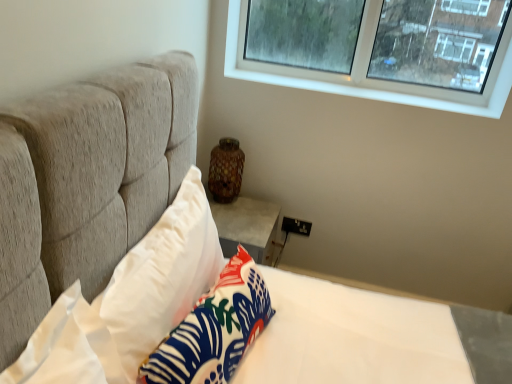
Locate an element on the screen. Image resolution: width=512 pixels, height=384 pixels. clear glass window at upper right is located at coordinates (364, 87).

Image resolution: width=512 pixels, height=384 pixels. Describe the element at coordinates (383, 90) in the screenshot. I see `white smooth stone at upper right` at that location.

The width and height of the screenshot is (512, 384). Identify the location of brown speckled ceramic vase at center. [x=226, y=170].

Find the location of a particular element. white fabric pillow at lower center, the 2th pillow when ordered from left to right is located at coordinates click(x=214, y=329).

In terms of size, does white fabric pillow at lower center, the first pillow from the right, appear bigger or smaller than white soft pillow at upper left, the 1th pillow when ordered from left to right?

In the image, white fabric pillow at lower center, the first pillow from the right, appears to be smaller than white soft pillow at upper left, the 1th pillow when ordered from left to right.

Is white fabric pillow at lower center, the first pillow from the right, situated inside white soft pillow at upper left, positioned as the 2th pillow in right-to-left order, or outside?

white fabric pillow at lower center, the first pillow from the right, is inside white soft pillow at upper left, positioned as the 2th pillow in right-to-left order.

From the image's perspective, is white fabric pillow at lower center, the 2th pillow when ordered from left to right, under white soft pillow at upper left, the 1th pillow when ordered from left to right?

Yes, from the image's perspective, white fabric pillow at lower center, the 2th pillow when ordered from left to right, is below white soft pillow at upper left, the 1th pillow when ordered from left to right.

Could you tell me if white fabric pillow at lower center, the 2th pillow when ordered from left to right, is turned towards white soft pillow at upper left, positioned as the 2th pillow in right-to-left order?

No, white fabric pillow at lower center, the 2th pillow when ordered from left to right, does not turn towards white soft pillow at upper left, positioned as the 2th pillow in right-to-left order.

Looking at their sizes, would you say white fabric pillow at lower center, the first pillow from the right, is wider or thinner than white smooth stone at upper right?

white fabric pillow at lower center, the first pillow from the right, is thinner than white smooth stone at upper right.

Between point (254, 326) and point (506, 96), which one is positioned in front?

The point (254, 326) is more forward.

Is white fabric pillow at lower center, the first pillow from the right, smaller than white smooth stone at upper right?

Incorrect, white fabric pillow at lower center, the first pillow from the right, is not smaller in size than white smooth stone at upper right.

From the image's perspective, is white fabric pillow at lower center, the 2th pillow when ordered from left to right, positioned above or below white smooth stone at upper right?

white fabric pillow at lower center, the 2th pillow when ordered from left to right, is below white smooth stone at upper right.

Considering the relative positions of brown speckled ceramic vase at center and white smooth stone at upper right in the image provided, is brown speckled ceramic vase at center to the left of white smooth stone at upper right from the viewer's perspective?

Yes, brown speckled ceramic vase at center is to the left of white smooth stone at upper right.

Does brown speckled ceramic vase at center have a larger size compared to white smooth stone at upper right?

Yes.

Which of these two, brown speckled ceramic vase at center or white smooth stone at upper right, is thinner?

With smaller width is brown speckled ceramic vase at center.

Who is shorter, brown speckled ceramic vase at center or white smooth stone at upper right?

With less height is white smooth stone at upper right.

Is clear glass window at upper right positioned with its back to brown speckled ceramic vase at center?

That's not correct — clear glass window at upper right is not looking away from brown speckled ceramic vase at center.

Between clear glass window at upper right and brown speckled ceramic vase at center, which one appears on the right side from the viewer's perspective?

clear glass window at upper right.

Is clear glass window at upper right surrounding brown speckled ceramic vase at center?

No, brown speckled ceramic vase at center is located outside of clear glass window at upper right.

Is clear glass window at upper right taller than white soft pillow at upper left, the 1th pillow when ordered from left to right?

In fact, clear glass window at upper right may be shorter than white soft pillow at upper left, the 1th pillow when ordered from left to right.

From the image's perspective, is clear glass window at upper right located above or below white soft pillow at upper left, the 1th pillow when ordered from left to right?

Clearly, from the image's perspective, clear glass window at upper right is above white soft pillow at upper left, the 1th pillow when ordered from left to right.

Can you tell me how much clear glass window at upper right and white soft pillow at upper left, positioned as the 2th pillow in right-to-left order, differ in facing direction?

88.8 degrees separate the facing orientations of clear glass window at upper right and white soft pillow at upper left, positioned as the 2th pillow in right-to-left order.

Does point (510, 62) come closer to viewer compared to point (169, 282)?

No.

Which object is positioned more to the left, white smooth stone at upper right or clear glass window at upper right?

white smooth stone at upper right is more to the left.

From the image's perspective, relative to clear glass window at upper right, is white smooth stone at upper right above or below?

Based on their image positions, white smooth stone at upper right is located beneath clear glass window at upper right.

Considering the sizes of white smooth stone at upper right and clear glass window at upper right in the image, is white smooth stone at upper right taller or shorter than clear glass window at upper right?

Clearly, white smooth stone at upper right is shorter compared to clear glass window at upper right.

Which object is closer to the camera taking this photo, brown speckled ceramic vase at center or white fabric pillow at lower center, the 2th pillow when ordered from left to right?

white fabric pillow at lower center, the 2th pillow when ordered from left to right.

Which of these two, brown speckled ceramic vase at center or white fabric pillow at lower center, the 2th pillow when ordered from left to right, stands shorter?

With less height is white fabric pillow at lower center, the 2th pillow when ordered from left to right.

Is brown speckled ceramic vase at center next to white fabric pillow at lower center, the 2th pillow when ordered from left to right?

No, brown speckled ceramic vase at center is not with white fabric pillow at lower center, the 2th pillow when ordered from left to right.

From a real-world perspective, which object stands above the other?

brown speckled ceramic vase at center.

Identify the location of pillow located on the right of white soft pillow at upper left, positioned as the 2th pillow in right-to-left order. (214, 329).

From the image's perspective, starting from the white smooth stone at upper right, which pillow is the 2nd one below? Please provide its 2D coordinates.

[(214, 329)]

When comparing their distances from white fabric pillow at lower center, the first pillow from the right, does white smooth stone at upper right or brown speckled ceramic vase at center seem closer?

brown speckled ceramic vase at center.

Looking at the image, which one is located further to clear glass window at upper right, white smooth stone at upper right or white fabric pillow at lower center, the first pillow from the right?

Among the two, white fabric pillow at lower center, the first pillow from the right, is located further to clear glass window at upper right.

Based on their spatial positions, is clear glass window at upper right or white smooth stone at upper right closer to white soft pillow at upper left, the 1th pillow when ordered from left to right?

The object closer to white soft pillow at upper left, the 1th pillow when ordered from left to right, is white smooth stone at upper right.

Based on their spatial positions, is clear glass window at upper right or white smooth stone at upper right further from white fabric pillow at lower center, the first pillow from the right?

clear glass window at upper right lies further to white fabric pillow at lower center, the first pillow from the right, than the other object.

Based on their spatial positions, is clear glass window at upper right or white smooth stone at upper right further from brown speckled ceramic vase at center?

clear glass window at upper right lies further to brown speckled ceramic vase at center than the other object.

Looking at the image, which one is located further to white smooth stone at upper right, brown speckled ceramic vase at center or white soft pillow at upper left, positioned as the 2th pillow in right-to-left order?

Based on the image, white soft pillow at upper left, positioned as the 2th pillow in right-to-left order, appears to be further to white smooth stone at upper right.

Which object lies nearer to the anchor point white soft pillow at upper left, positioned as the 2th pillow in right-to-left order, white smooth stone at upper right or clear glass window at upper right?

white smooth stone at upper right is closer to white soft pillow at upper left, positioned as the 2th pillow in right-to-left order.

Estimate the real-world distances between objects in this image. Which object is further from white fabric pillow at lower center, the 2th pillow when ordered from left to right, white smooth stone at upper right or clear glass window at upper right?

clear glass window at upper right is positioned further to the anchor white fabric pillow at lower center, the 2th pillow when ordered from left to right.

I want to click on window sill situated between brown speckled ceramic vase at center and clear glass window at upper right from left to right, so click(383, 90).

Find the location of a particular element. This screenshot has width=512, height=384. window located between white soft pillow at upper left, the 1th pillow when ordered from left to right, and brown speckled ceramic vase at center in the depth direction is located at coordinates (364, 87).

Where is `window sill located between white soft pillow at upper left, the 1th pillow when ordered from left to right, and brown speckled ceramic vase at center in the depth direction`? The width and height of the screenshot is (512, 384). window sill located between white soft pillow at upper left, the 1th pillow when ordered from left to right, and brown speckled ceramic vase at center in the depth direction is located at coordinates (383, 90).

The height and width of the screenshot is (384, 512). I want to click on window between white soft pillow at upper left, the 1th pillow when ordered from left to right, and white smooth stone at upper right, along the z-axis, so click(364, 87).